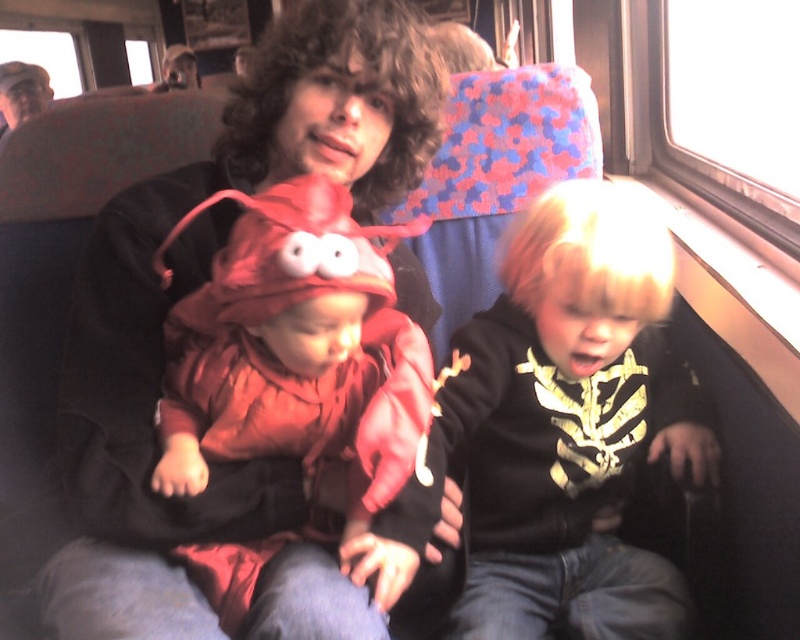
You are a photographer trying to capture a closeup of the rubber lobster at center without the matte black cap at upper left appearing in the shot. Based on their positions, is this possible?

Yes, the rubber lobster at center is in front of the matte black cap at upper left, so you can position the camera to focus on the rubber lobster at center while keeping the matte black cap at upper left out of the frame.

You are standing in the train and want to move from point A to point B. Point A is at coordinate point (241, 243) and point B is at coordinate point (40, 72). Which point is closer to you when you start at point A?

Point A is at coordinate point (241, 243) is closer to the viewer than point (40, 72), so when you start at point A, point A is already closer to you. However, if you are moving from point A to point B, point B would be further away from the viewer compared to point A.